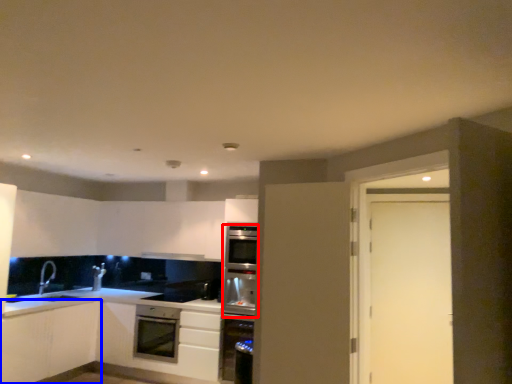
Question: Which point is closer to the camera, oven (highlighted by a red box) or cabinetry (highlighted by a blue box)?

Choices:
 (A) oven
 (B) cabinetry

Answer: (B)